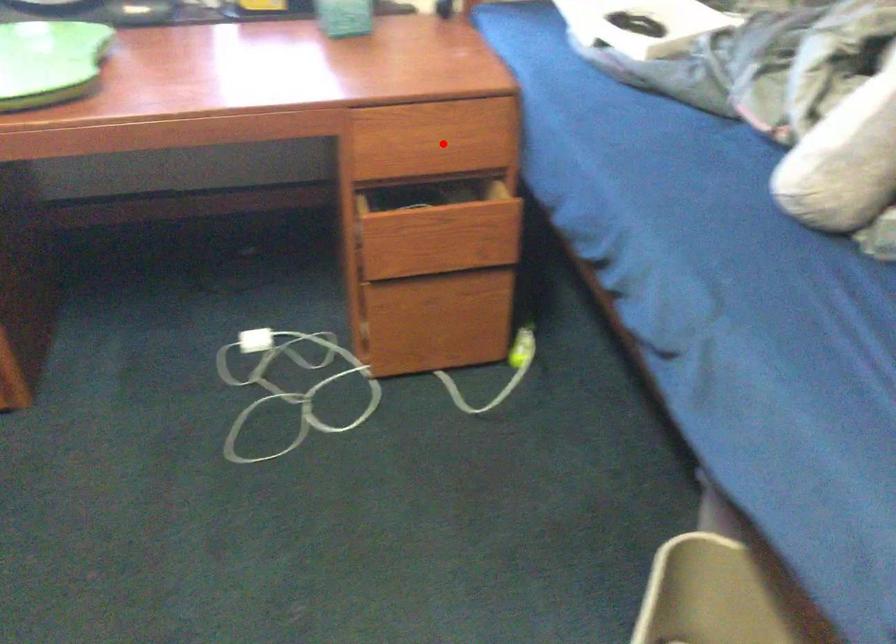
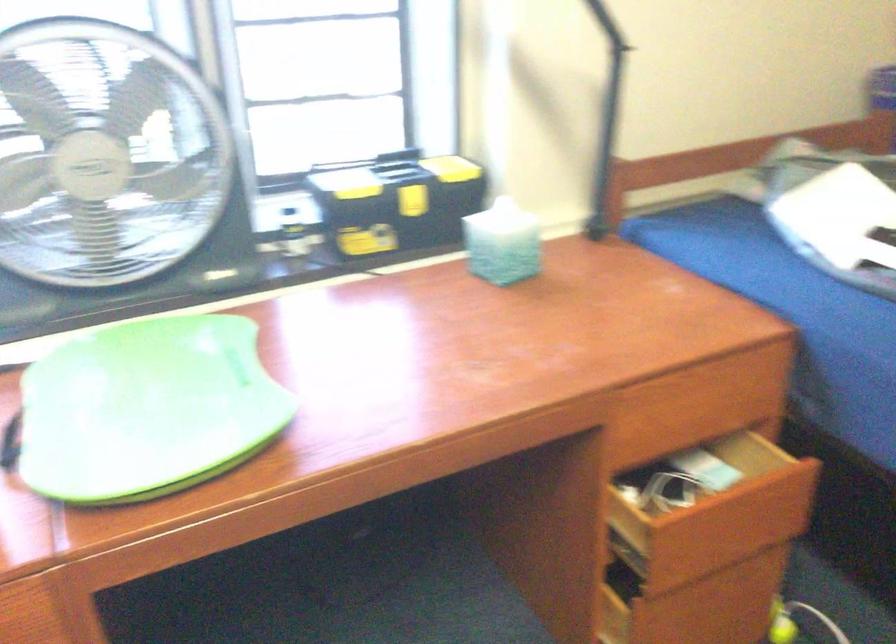
Question: I am providing you with two images of the same scene from different viewpoints. A red point is shown in image1. For the corresponding object point in image2, is it positioned nearer or farther from the camera?

Choices:
 (A) Nearer
 (B) Farther

Answer: (A)